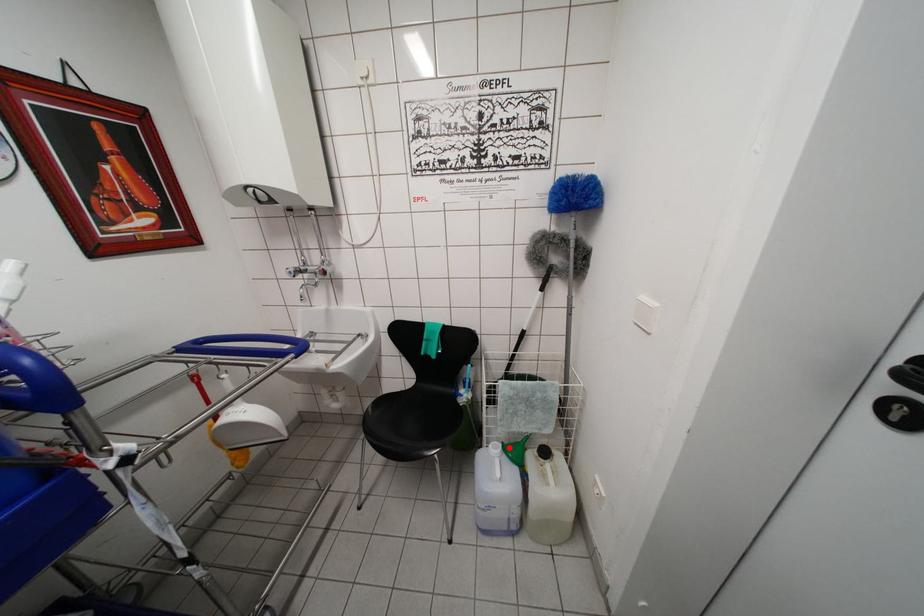
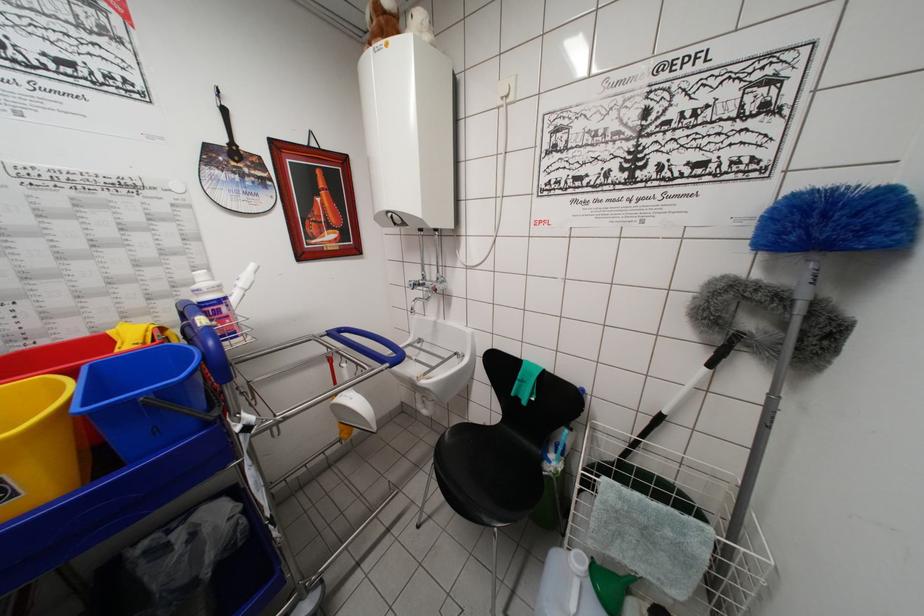
Question: I am providing you with two images of the same scene from different viewpoints. In image1, a red point is highlighted. Considering the same 3D point in image2, which of the following is correct?

Choices:
 (A) It is closer
 (B) It is farther

Answer: (A)